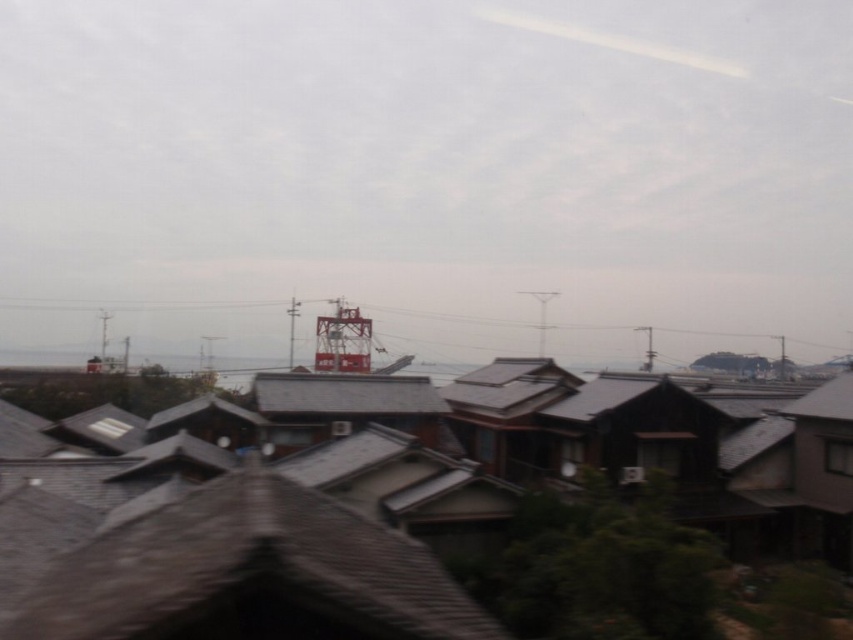
Can you confirm if gray tile roof at center is positioned above metallic red tower at center?

No.

Does gray tile roof at center have a lesser height compared to metallic red tower at center?

Yes.

Where is `gray tile roof at center`? gray tile roof at center is located at coordinates (412, 506).